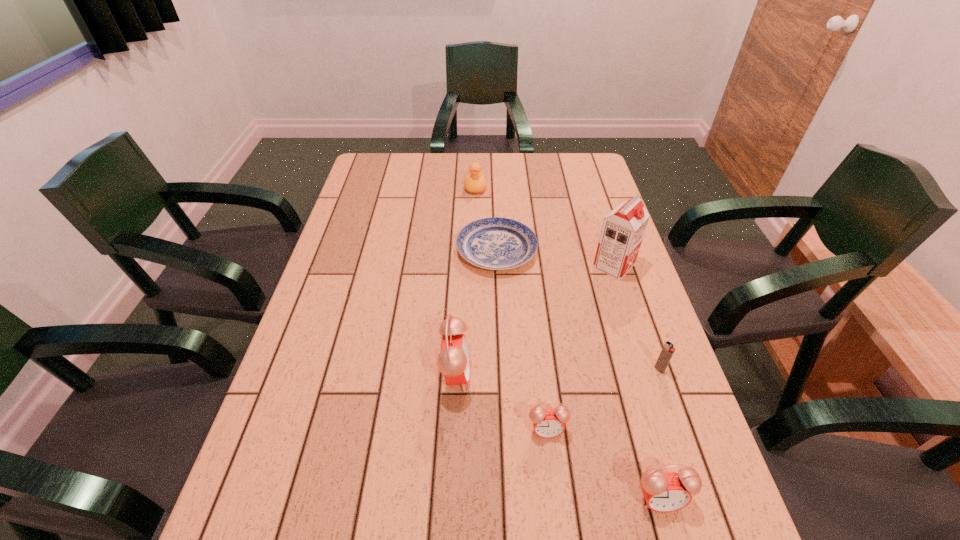
Locate an element on the screen. vacant position in the image that satisfies the following two spatial constraints: 1. on the face of the soya milk; 2. on the right side of the duck is located at coordinates (474, 266).

At what (x,y) coordinates should I click in order to perform the action: click on vacant space that satisfies the following two spatial constraints: 1. on the front side of the soya milk; 2. on the left side of the shortest object. Please return your answer as a coordinate pair (x, y). Looking at the image, I should click on (497, 266).

Identify the location of free space that satisfies the following two spatial constraints: 1. on the face of the farthest object; 2. on the right side of the tallest object. [474, 266].